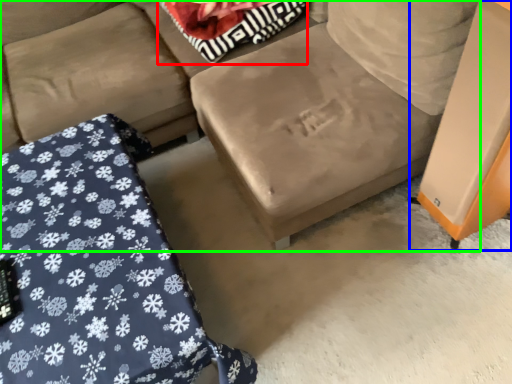
Question: Estimate the real-world distances between objects in this image. Which object is closer to pillow (highlighted by a red box), table (highlighted by a blue box) or studio couch (highlighted by a green box)?

Choices:
 (A) table
 (B) studio couch

Answer: (B)